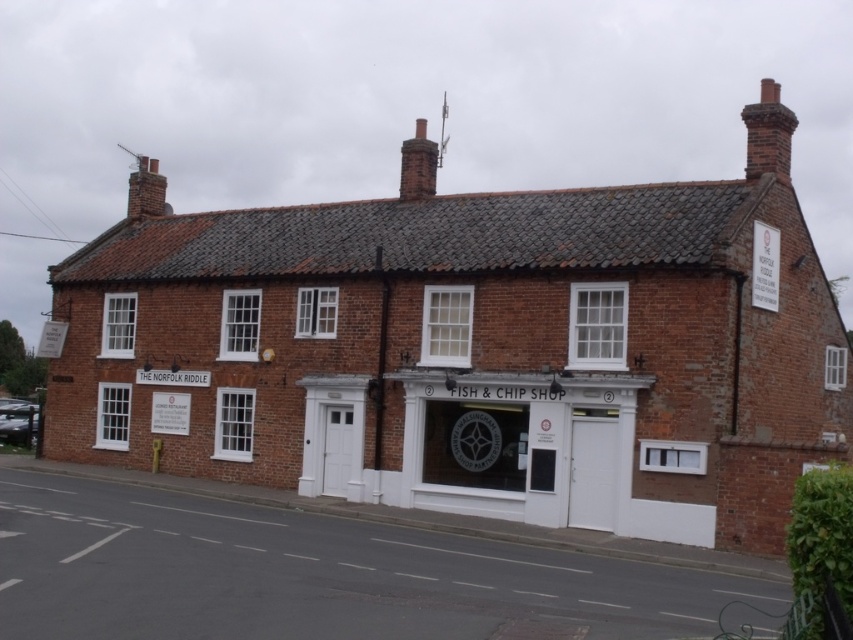
Is brick chimney at upper center smaller than red brick chimney at center?

No, brick chimney at upper center is not smaller than red brick chimney at center.

This screenshot has height=640, width=853. What do you see at coordinates (469, 355) in the screenshot? I see `brick chimney at upper center` at bounding box center [469, 355].

Locate an element on the screen. brick chimney at upper center is located at coordinates (469, 355).

Can you confirm if red brick chimney at center is positioned above brick chimney at upper left?

Yes.

Between point (412, 186) and point (131, 214), which one is positioned in front?

Point (412, 186) is more forward.

Where is `red brick chimney at center`? This screenshot has width=853, height=640. red brick chimney at center is located at coordinates (416, 164).

From the picture: Can you confirm if red brick chimney at upper right is wider than brick chimney at upper left?

Yes, red brick chimney at upper right is wider than brick chimney at upper left.

Between red brick chimney at upper right and brick chimney at upper left, which one has less height?

Standing shorter between the two is brick chimney at upper left.

Between point (782, 138) and point (137, 170), which one is positioned behind?

The point (137, 170) is more distant.

Identify the location of red brick chimney at upper right. (769, 132).